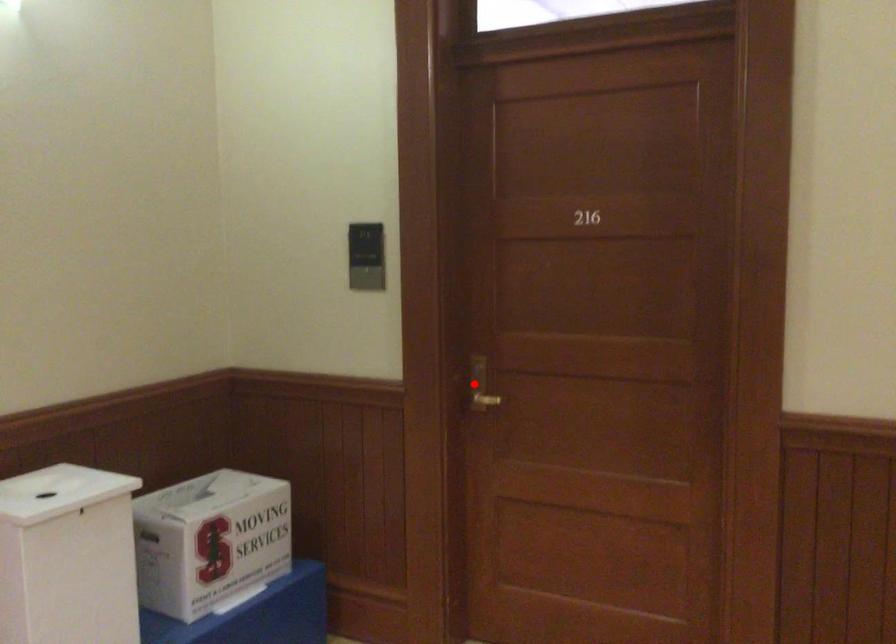
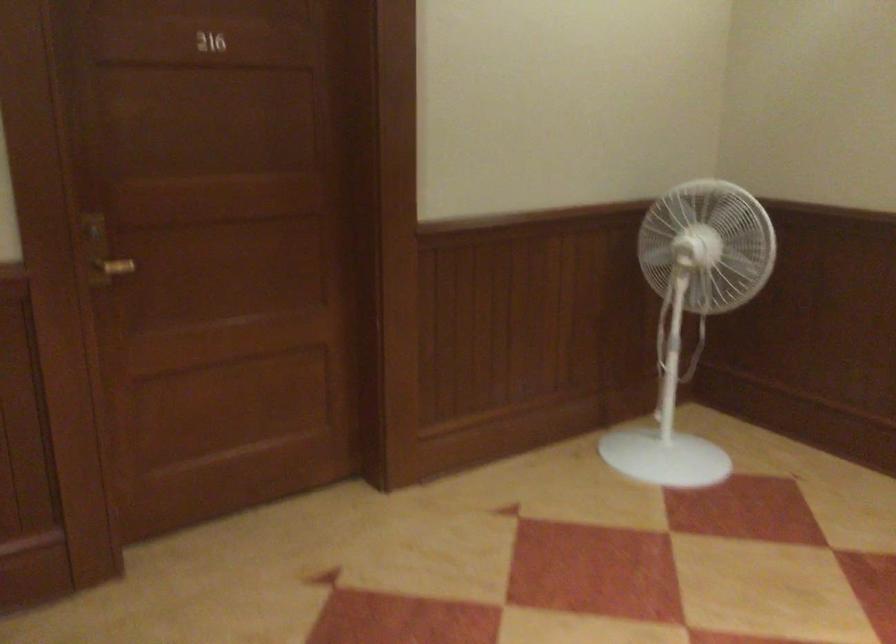
Question: I am providing you with two images of the same scene from different viewpoints. In image1, a red point is highlighted. Considering the same 3D point in image2, which of the following is correct?

Choices:
 (A) It is closer
 (B) It is farther

Answer: (A)